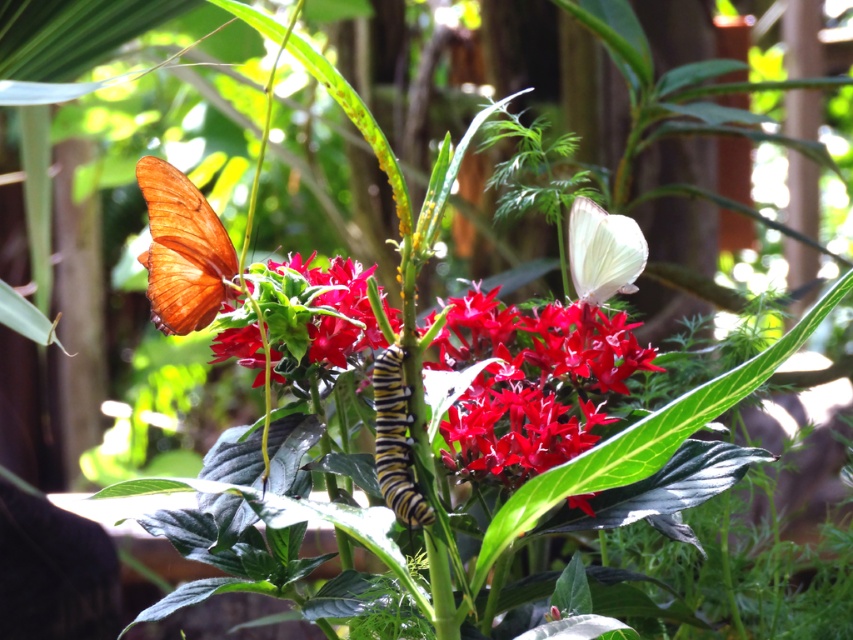
Identify the location of shiny orange butterfly at left. (183, 250).

Between point (195, 260) and point (403, 436), which one is positioned behind?

The point (195, 260) is more distant.

Find the location of a particular element. The image size is (853, 640). shiny orange butterfly at left is located at coordinates (183, 250).

From the picture: Does shiny orange butterfly at left have a lesser height compared to matte white butterfly at upper right?

No.

Who is more distant from viewer, (160, 272) or (595, 248)?

Positioned behind is point (595, 248).

Between point (148, 284) and point (570, 244), which one is positioned behind?

The point (570, 244) is more distant.

Locate an element on the screen. shiny orange butterfly at left is located at coordinates (183, 250).

Who is positioned more to the left, smooth glossy red flower at center or shiny orange butterfly at left?

shiny orange butterfly at left

Which is below, smooth glossy red flower at center or shiny orange butterfly at left?

smooth glossy red flower at center

Which is behind, point (322, 321) or point (213, 237)?

The point (213, 237) is more distant.

This screenshot has width=853, height=640. Identify the location of smooth glossy red flower at center. (529, 381).